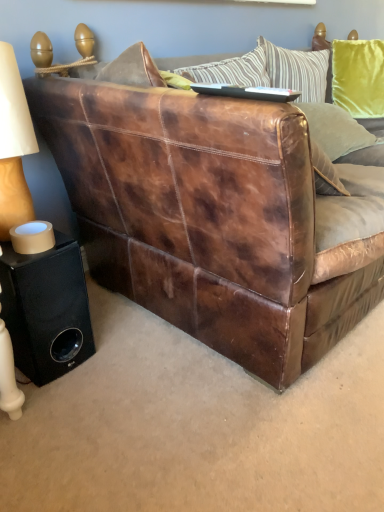
Find the location of a particular element. The image size is (384, 512). free spot in front of black matte speaker at lower left is located at coordinates (52, 414).